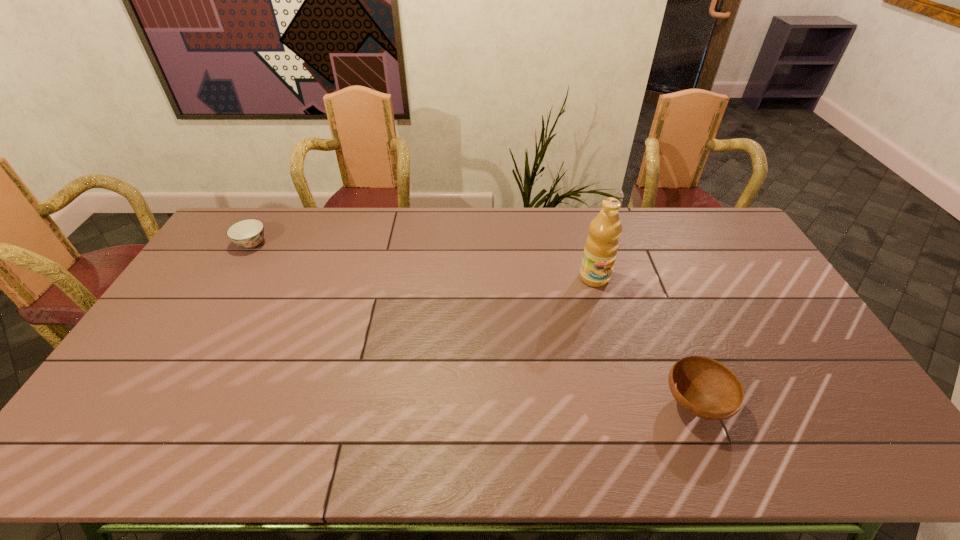
Where is `vacant space in between the soup bowl and the nearest object`? vacant space in between the soup bowl and the nearest object is located at coordinates (473, 324).

Identify the location of free space between the rightmost object and the second object from right to left. (645, 341).

At what (x,y) coordinates should I click in order to perform the action: click on free area in between the farthest object and the tallest object. Please return your answer as a coordinate pair (x, y). Looking at the image, I should click on (423, 261).

Where is `vacant space that is in between the tallest object and the rightmost object`? vacant space that is in between the tallest object and the rightmost object is located at coordinates (645, 341).

At what (x,y) coordinates should I click in order to perform the action: click on vacant space that's between the nearest object and the shortest object. Please return your answer as a coordinate pair (x, y). The height and width of the screenshot is (540, 960). Looking at the image, I should click on (473, 324).

Where is `free space between the farthest object and the tallest object`? This screenshot has width=960, height=540. free space between the farthest object and the tallest object is located at coordinates (423, 261).

Find the location of a particular element. The image size is (960, 540). vacant region between the shortest object and the nearest object is located at coordinates (473, 324).

You are a GUI agent. You are given a task and a screenshot of the screen. Output one action in this format:
    pyautogui.click(x=<x>, y=<y>)
    Task: Click on the object that can be found as the second closest to the rightmost object
    The width and height of the screenshot is (960, 540).
    Given the screenshot: What is the action you would take?
    (248, 233)

Image resolution: width=960 pixels, height=540 pixels. Find the location of `object that is the second closest one to the second object from left to right`. object that is the second closest one to the second object from left to right is located at coordinates (248, 233).

Locate an element on the screen. Image resolution: width=960 pixels, height=540 pixels. vacant space that satisfies the following two spatial constraints: 1. on the label of the rightmost object; 2. on the left side of the olive oil is located at coordinates (629, 403).